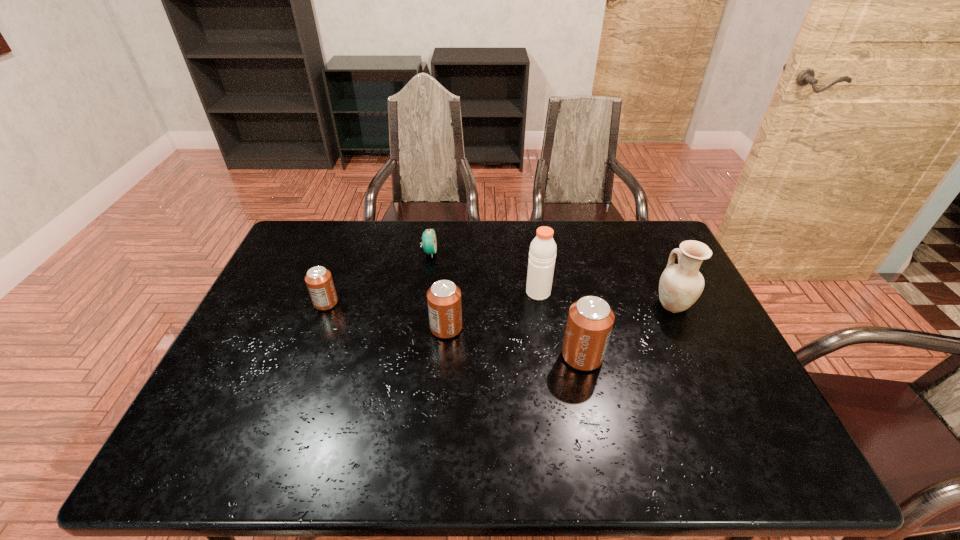
You are a GUI agent. You are given a task and a screenshot of the screen. Output one action in this format:
    pyautogui.click(x=<x>, y=<y>)
    Task: Click on the vacant space in between the rightmost object and the leftmost object
    This screenshot has height=540, width=960.
    Given the screenshot: What is the action you would take?
    pos(499,303)

Where is `the fifth closest object to the farthest object`? The image size is (960, 540). the fifth closest object to the farthest object is located at coordinates coord(680,285).

Select which object appears as the fifth closest to the farthest object. Please provide its 2D coordinates. Your answer should be formatted as a tuple, i.e. [(x, y)], where the tuple contains the x and y coordinates of a point satisfying the conditions above.

[(680, 285)]

Image resolution: width=960 pixels, height=540 pixels. What are the coordinates of `can that can be found as the closest to the leftmost object` in the screenshot? It's located at (444, 303).

Locate an element on the screen. The image size is (960, 540). the closest can relative to the nearest can is located at coordinates (444, 303).

At what (x,y) coordinates should I click in order to perform the action: click on vacant space that satisfies the following two spatial constraints: 1. on the front-facing side of the farthest object; 2. on the left side of the nearest object. Please return your answer as a coordinate pair (x, y). This screenshot has height=540, width=960. Looking at the image, I should click on (415, 356).

Locate an element on the screen. The width and height of the screenshot is (960, 540). vacant position in the image that satisfies the following two spatial constraints: 1. on the back side of the pottery; 2. on the left side of the second nearest can is located at coordinates (448, 305).

You are a GUI agent. You are given a task and a screenshot of the screen. Output one action in this format:
    pyautogui.click(x=<x>, y=<y>)
    Task: Click on the free region that satisfies the following two spatial constraints: 1. on the front-facing side of the shortest object; 2. on the left side of the nearest object
    The width and height of the screenshot is (960, 540).
    Given the screenshot: What is the action you would take?
    pyautogui.click(x=415, y=356)